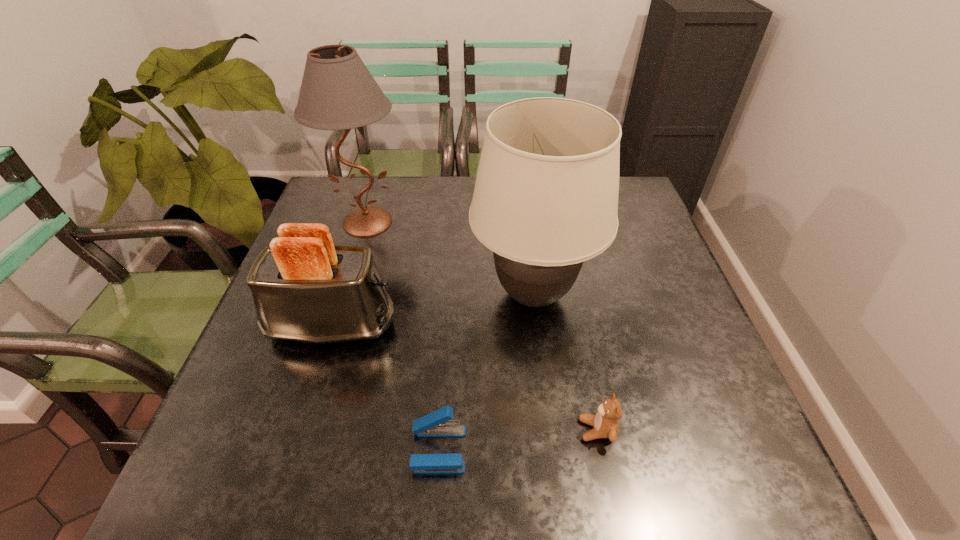
Identify which object is the second closest to the lampshade. Please provide its 2D coordinates. Your answer should be formatted as a tuple, i.e. [(x, y)], where the tuple contains the x and y coordinates of a point satisfying the conditions above.

[(306, 289)]

Locate which object is the closest to the lampshade. Please provide its 2D coordinates. Your answer should be formatted as a tuple, i.e. [(x, y)], where the tuple contains the x and y coordinates of a point satisfying the conditions above.

[(606, 421)]

The width and height of the screenshot is (960, 540). Find the location of `vacant position in the image that satisfies the following two spatial constraints: 1. on the side of the third object from right to left with the control lever; 2. on the right side of the toaster`. vacant position in the image that satisfies the following two spatial constraints: 1. on the side of the third object from right to left with the control lever; 2. on the right side of the toaster is located at coordinates (294, 449).

At what (x,y) coordinates should I click in order to perform the action: click on free space that satisfies the following two spatial constraints: 1. on the side of the third object from left to right with the control lever; 2. on the left side of the toaster. Please return your answer as a coordinate pair (x, y). Looking at the image, I should click on (294, 449).

Where is `vacant space that satisfies the following two spatial constraints: 1. on the front-facing side of the lampshade; 2. on the right side of the farthest object`? The width and height of the screenshot is (960, 540). vacant space that satisfies the following two spatial constraints: 1. on the front-facing side of the lampshade; 2. on the right side of the farthest object is located at coordinates (346, 295).